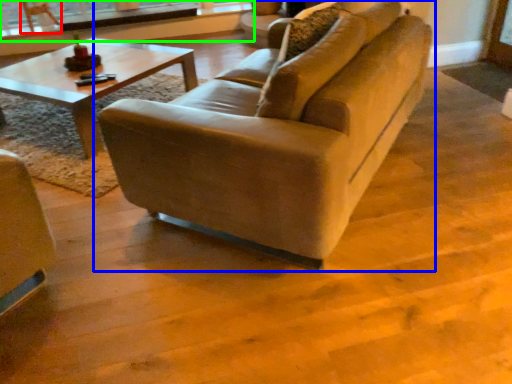
Question: Based on their relative distances, which object is farther from armchair (highlighted by a red box)? Choose from studio couch (highlighted by a blue box) and window frame (highlighted by a green box).

Choices:
 (A) studio couch
 (B) window frame

Answer: (A)